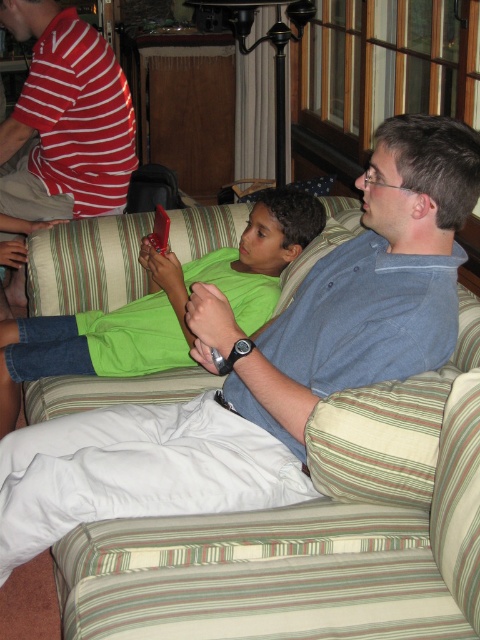
Can you confirm if red striped shirt at upper left is bigger than rubberized plastic phone at center?

Yes.

Who is positioned more to the right, red striped shirt at upper left or rubberized plastic phone at center?

rubberized plastic phone at center is more to the right.

Between point (108, 52) and point (162, 218), which one is positioned behind?

Positioned behind is point (108, 52).

Find the location of `red striped shirt at upper left`. red striped shirt at upper left is located at coordinates (71, 109).

Describe the element at coordinates (162, 305) in the screenshot. This screenshot has height=640, width=480. I see `green matte shirt at center` at that location.

Is green matte shirt at center bigger than red striped shirt at upper left?

Yes, green matte shirt at center is bigger than red striped shirt at upper left.

Between point (201, 275) and point (91, 179), which one is positioned behind?

The point (91, 179) is more distant.

Locate an element on the screen. The height and width of the screenshot is (640, 480). green matte shirt at center is located at coordinates (162, 305).

Can you confirm if green striped fabric couch at center is positioned to the right of green matte shirt at center?

Indeed, green striped fabric couch at center is positioned on the right side of green matte shirt at center.

Which is behind, point (222, 564) or point (215, 250)?

The point (215, 250) is more distant.

Find the location of a particular element. Image resolution: width=480 pixels, height=640 pixels. green striped fabric couch at center is located at coordinates (284, 540).